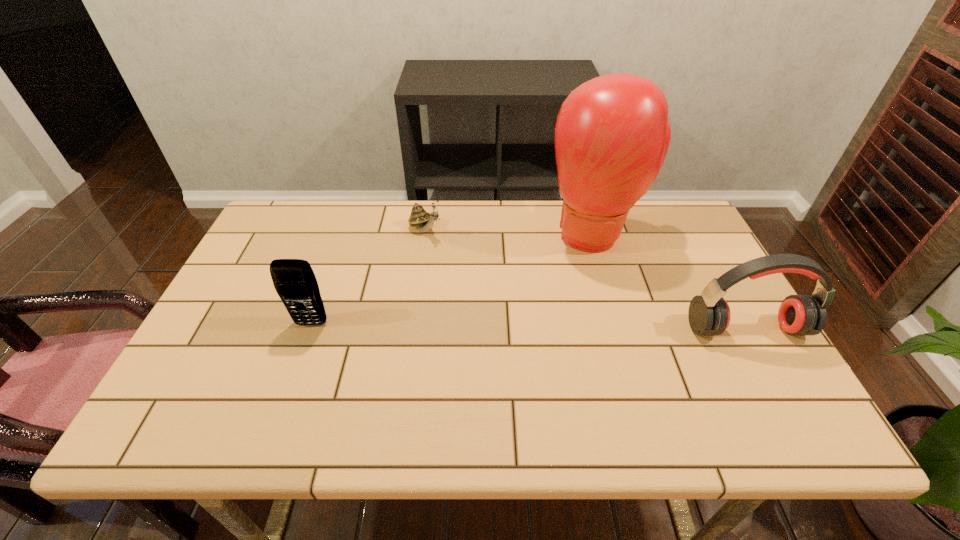
This screenshot has height=540, width=960. I want to click on cellular telephone, so click(x=294, y=280).

The height and width of the screenshot is (540, 960). Identify the location of the rightmost object. (709, 314).

Where is `the shortest object`? the shortest object is located at coordinates (424, 221).

You are a GUI agent. You are given a task and a screenshot of the screen. Output one action in this format:
    pyautogui.click(x=<x>, y=<y>)
    Task: Click on the snail
    
    Given the screenshot: What is the action you would take?
    pyautogui.click(x=424, y=221)

Where is `the third object from left to right`? The width and height of the screenshot is (960, 540). the third object from left to right is located at coordinates (612, 134).

I want to click on the tallest object, so click(612, 134).

Locate an element on the screen. This screenshot has height=540, width=960. free space located 0.060m on the screen of the leftmost object is located at coordinates (301, 349).

Locate an element on the screen. blank area located 0.120m on the ear cups of the rightmost object is located at coordinates (779, 388).

This screenshot has width=960, height=540. What are the coordinates of `vacant area situated on the face of the snail` in the screenshot? It's located at (485, 273).

What are the coordinates of `blank space located on the face of the snail` in the screenshot? It's located at (497, 282).